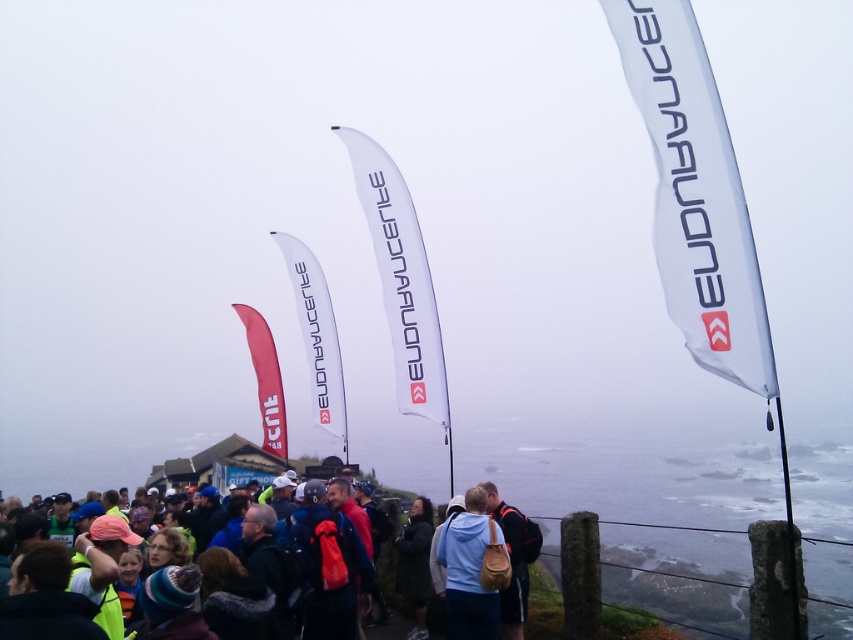
Does light blue fabric jacket at center appear over light blue jacket at center?

Yes.

Can you confirm if light blue fabric jacket at center is positioned to the left of light blue jacket at center?

Incorrect, light blue fabric jacket at center is not on the left side of light blue jacket at center.

Is point (479, 547) positioned behind point (482, 515)?

No, (479, 547) is in front of (482, 515).

Locate an element on the screen. light blue fabric jacket at center is located at coordinates (467, 572).